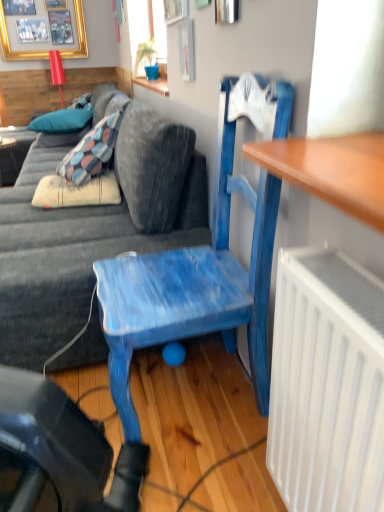
Question: From the image's perspective, would you say matte black desk at left is positioned over velvet blue couch at center?

Choices:
 (A) yes
 (B) no

Answer: (A)

Question: Is matte black desk at left outside of velvet blue couch at center?

Choices:
 (A) no
 (B) yes

Answer: (B)

Question: Considering the relative sizes of matte black desk at left and velvet blue couch at center in the image provided, is matte black desk at left smaller than velvet blue couch at center?

Choices:
 (A) no
 (B) yes

Answer: (B)

Question: Considering the relative sizes of matte black desk at left and velvet blue couch at center in the image provided, is matte black desk at left shorter than velvet blue couch at center?

Choices:
 (A) yes
 (B) no

Answer: (A)

Question: Does matte black desk at left lie in front of velvet blue couch at center?

Choices:
 (A) yes
 (B) no

Answer: (B)

Question: Can you confirm if matte black desk at left is positioned to the right of velvet blue couch at center?

Choices:
 (A) no
 (B) yes

Answer: (A)

Question: Considering the relative positions of blue painted wood chair at center and blue fabric pillow at upper left, the first pillow from the top, in the image provided, is blue painted wood chair at center to the left of blue fabric pillow at upper left, the first pillow from the top, from the viewer's perspective?

Choices:
 (A) no
 (B) yes

Answer: (A)

Question: Does blue painted wood chair at center have a greater width compared to blue fabric pillow at upper left, the first pillow from the top?

Choices:
 (A) yes
 (B) no

Answer: (B)

Question: Considering the relative sizes of blue painted wood chair at center and blue fabric pillow at upper left, the first pillow from the top, in the image provided, is blue painted wood chair at center smaller than blue fabric pillow at upper left, the first pillow from the top,?

Choices:
 (A) no
 (B) yes

Answer: (A)

Question: From the image's perspective, would you say blue painted wood chair at center is shown under blue fabric pillow at upper left, which is counted as the second pillow, starting from the bottom?

Choices:
 (A) no
 (B) yes

Answer: (B)

Question: From a real-world perspective, is blue painted wood chair at center below blue fabric pillow at upper left, which is counted as the second pillow, starting from the bottom?

Choices:
 (A) no
 (B) yes

Answer: (B)

Question: Is blue painted wood chair at center not within blue fabric pillow at upper left, the first pillow from the top?

Choices:
 (A) no
 (B) yes

Answer: (B)

Question: Are blue fabric pillow at upper left, the first pillow from the bottom, and gold framed picture at upper left beside each other?

Choices:
 (A) no
 (B) yes

Answer: (A)